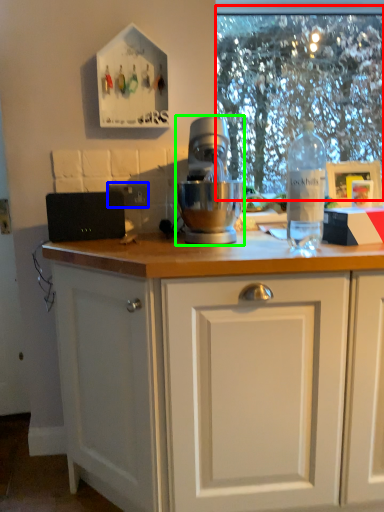
Question: Which object is positioned farthest from clear (highlighted by a red box)? Select from electric outlet (highlighted by a blue box) and mixer (highlighted by a green box).

Choices:
 (A) electric outlet
 (B) mixer

Answer: (A)